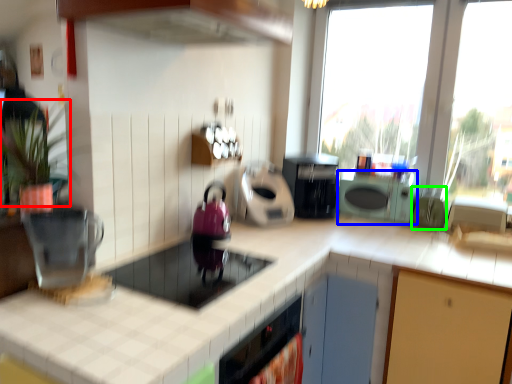
Question: Considering the real-world distances, which object is closest to plant (highlighted by a red box)? cabinetry (highlighted by a blue box) or appliance (highlighted by a green box).

Choices:
 (A) cabinetry
 (B) appliance

Answer: (A)